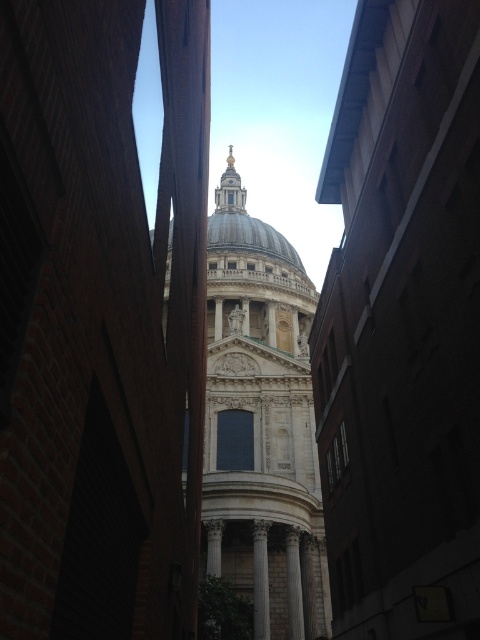
Question: Which point is closer to the camera?

Choices:
 (A) white stone church at center
 (B) white marble column at center
 (C) white marble pillar at center

Answer: (A)

Question: Can you confirm if white marble dome at center is positioned below white marble pillar at center?

Choices:
 (A) no
 (B) yes

Answer: (A)

Question: Which of the following is the farthest from the observer?

Choices:
 (A) white stone church at center
 (B) white marble pillar at center

Answer: (B)

Question: Which point is farther to the camera?

Choices:
 (A) (256, 634)
 (B) (294, 586)
 (C) (219, 460)
 (D) (235, 179)

Answer: (D)

Question: Is white marble dome at center to the right of white marble pillar at center from the viewer's perspective?

Choices:
 (A) no
 (B) yes

Answer: (A)

Question: Does white stone church at center lie in front of white marble pillar at center?

Choices:
 (A) yes
 (B) no

Answer: (A)